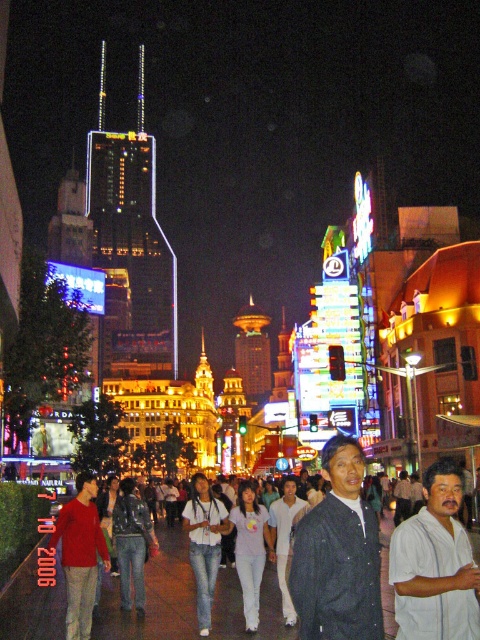
Is point (415, 563) positioned after point (92, 570)?

That is False.

Is white cotton shirt at lower right above matte red sweater at center?

Yes.

Locate an element on the screen. This screenshot has height=640, width=480. white cotton shirt at lower right is located at coordinates (434, 564).

Is smooth concrete pavement at center to the left of dark blue denim shirt at center from the viewer's perspective?

Indeed, smooth concrete pavement at center is positioned on the left side of dark blue denim shirt at center.

Who is lower down, smooth concrete pavement at center or dark blue denim shirt at center?

smooth concrete pavement at center is lower down.

Between point (272, 612) and point (350, 436), which one is positioned in front?

Point (272, 612) is more forward.

Identify the location of smooth concrete pavement at center. (155, 596).

Is dark blue denim shirt at center thinner than white cotton shirt at lower right?

No.

Is point (343, 454) less distant than point (454, 596)?

No, (343, 454) is further to viewer.

Image resolution: width=480 pixels, height=640 pixels. What are the coordinates of `dark blue denim shirt at center` in the screenshot? It's located at (337, 554).